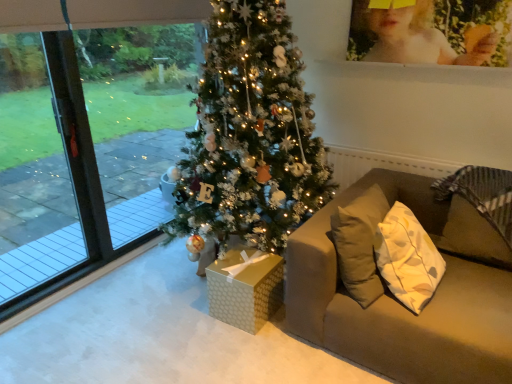
Question: From a real-world perspective, relative to gold textured gift box at center, is transparent glass screen door at left vertically above or below?

Choices:
 (A) below
 (B) above

Answer: (B)

Question: Considering their positions, is transparent glass screen door at left located in front of or behind gold textured gift box at center?

Choices:
 (A) behind
 (B) front

Answer: (B)

Question: Based on their relative distances, which object is nearer to the matte yellow photo frame at upper right?

Choices:
 (A) matte brown couch at right
 (B) transparent glass window at left
 (C) gold textured gift box at center
 (D) transparent glass screen door at left

Answer: (A)

Question: Estimate the real-world distances between objects in this image. Which object is closer to the transparent glass window at left?

Choices:
 (A) transparent glass screen door at left
 (B) matte brown couch at right
 (C) matte yellow photo frame at upper right
 (D) gold textured gift box at center

Answer: (A)